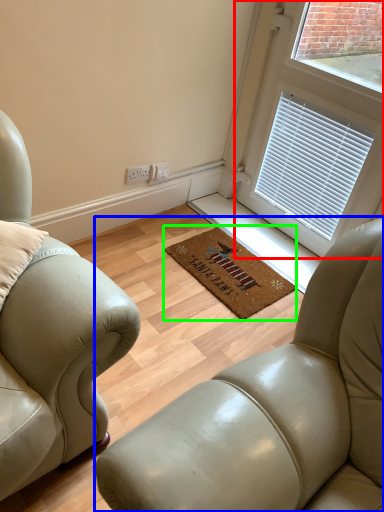
Question: Which object is positioned farthest from window (highlighted by a red box)? Select from studio couch (highlighted by a blue box) and mat (highlighted by a green box).

Choices:
 (A) studio couch
 (B) mat

Answer: (A)